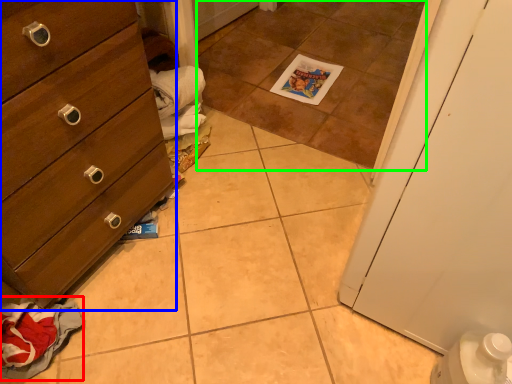
Question: Considering the real-world distances, which object is farthest from material (highlighted by a red box)? chest of drawers (highlighted by a blue box) or tile (highlighted by a green box)?

Choices:
 (A) chest of drawers
 (B) tile

Answer: (B)